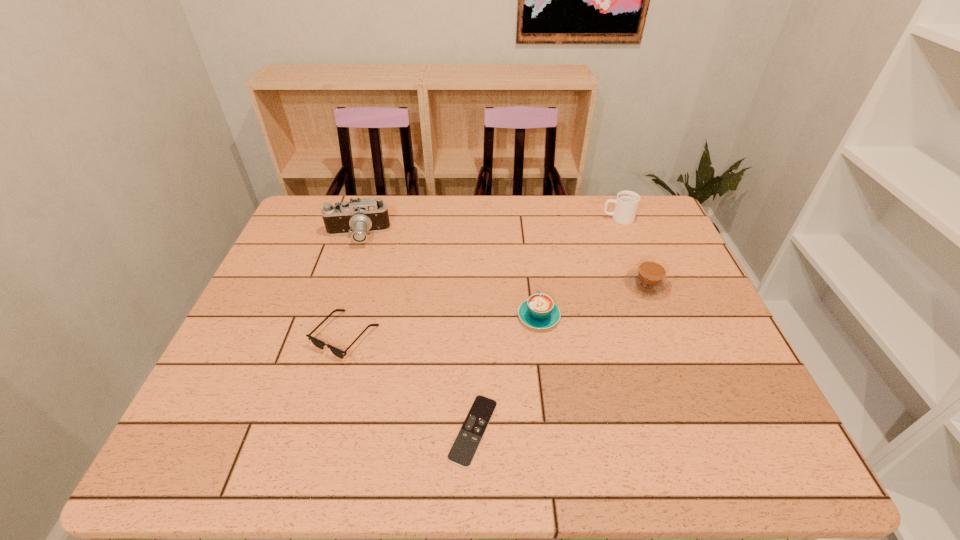
Image resolution: width=960 pixels, height=540 pixels. I want to click on camera located at the far edge, so click(357, 218).

What are the coordinates of `cappuccino present at the far edge` in the screenshot? It's located at (626, 203).

Locate an element on the screen. Image resolution: width=960 pixels, height=540 pixels. object present at the near edge is located at coordinates (462, 452).

Locate an element on the screen. This screenshot has height=540, width=960. object at the left edge is located at coordinates (357, 218).

What are the coordinates of `object located in the far left corner section of the desktop` in the screenshot? It's located at (357, 218).

Where is `object that is at the far right corner`? This screenshot has height=540, width=960. object that is at the far right corner is located at coordinates (626, 203).

In order to click on free space at the far edge in this screenshot , I will do `click(459, 222)`.

The image size is (960, 540). Find the location of `vacant region at the near edge of the desktop`. vacant region at the near edge of the desktop is located at coordinates (490, 470).

The height and width of the screenshot is (540, 960). What are the coordinates of `vacant space at the left edge of the desktop` in the screenshot? It's located at (267, 303).

In the image, there is a desktop. Find the location of `vacant space at the right edge`. vacant space at the right edge is located at coordinates (684, 274).